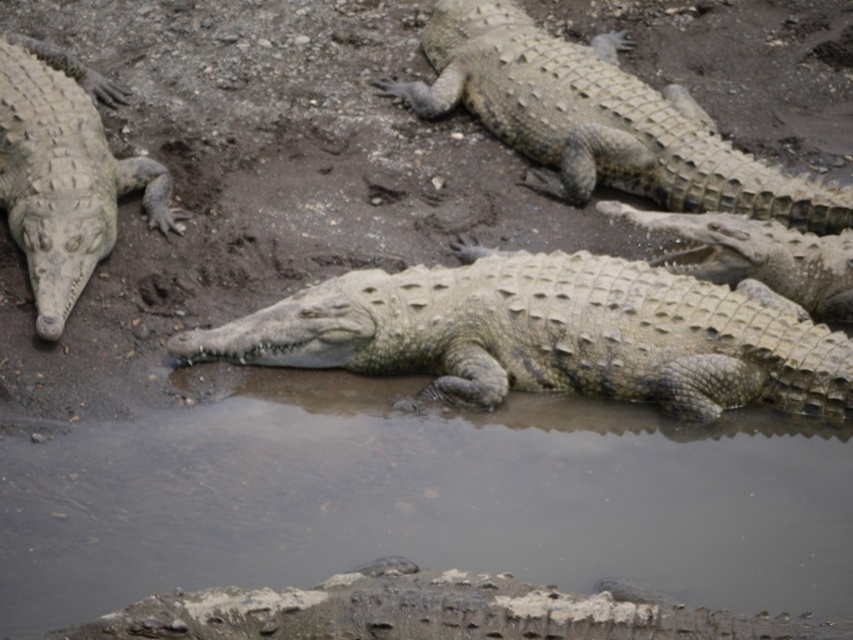
Measure the distance between point (788, 557) and camera.

4.83 meters

Based on the photo, is translucent mud puddle at center taller than matte gray crocodile at left?

Incorrect, translucent mud puddle at center's height is not larger of matte gray crocodile at left's.

In the scene shown: Measure the distance between point (770, 436) and camera.

A distance of 18.53 feet exists between point (770, 436) and camera.

Find the location of `translucent mud puddle at center`. translucent mud puddle at center is located at coordinates (422, 499).

Which is above, sandy textured crocodile at center or leathery gray crocodile at lower center?

sandy textured crocodile at center

The height and width of the screenshot is (640, 853). Describe the element at coordinates (549, 336) in the screenshot. I see `sandy textured crocodile at center` at that location.

Is point (630, 284) positioned after point (184, 620)?

Yes, point (630, 284) is behind point (184, 620).

Where is `sandy textured crocodile at center`? sandy textured crocodile at center is located at coordinates (549, 336).

Can you confirm if leathery gray crocodile at lower center is positioned to the right of matte gray crocodile at left?

Indeed, leathery gray crocodile at lower center is positioned on the right side of matte gray crocodile at left.

Can you confirm if leathery gray crocodile at lower center is positioned to the left of matte gray crocodile at left?

No, leathery gray crocodile at lower center is not to the left of matte gray crocodile at left.

Is point (654, 632) closer to viewer compared to point (47, 96)?

Yes, it is.

Identify the location of leathery gray crocodile at lower center. (434, 612).